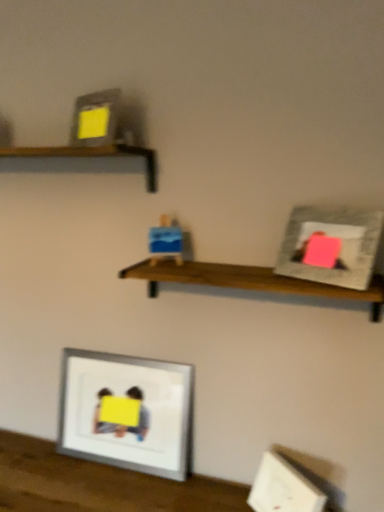
Question: Can you confirm if matte gray picture frame at upper right, the first picture frame from the front, is taller than wooden shelf at center, which is counted as the first shelf, starting from the right?

Choices:
 (A) no
 (B) yes

Answer: (B)

Question: Is matte gray picture frame at upper right, the 2th picture frame when ordered from back to front, touching wooden shelf at center, which is the 2th shelf in left-to-right order?

Choices:
 (A) no
 (B) yes

Answer: (A)

Question: Is matte gray picture frame at upper right, the first picture frame from the front, closer to camera compared to wooden shelf at center, which is the 2th shelf in top-to-bottom order?

Choices:
 (A) no
 (B) yes

Answer: (B)

Question: From a real-world perspective, is matte gray picture frame at upper right, placed as the 2th picture frame when sorted from left to right, positioned under wooden shelf at center, which is the 2th shelf in top-to-bottom order, based on gravity?

Choices:
 (A) yes
 (B) no

Answer: (B)

Question: Can we say matte gray picture frame at upper right, arranged as the first picture frame when viewed from the top, lies outside wooden shelf at center, the first shelf positioned from the bottom?

Choices:
 (A) no
 (B) yes

Answer: (B)

Question: In the image, is wooden shelf at upper left, which appears as the 1th shelf when viewed from the left, on the left side or the right side of wooden shelf at center, which is the 2th shelf in top-to-bottom order?

Choices:
 (A) right
 (B) left

Answer: (B)

Question: Which is correct: wooden shelf at upper left, positioned as the second shelf in right-to-left order, is inside wooden shelf at center, the first shelf positioned from the bottom, or outside of it?

Choices:
 (A) inside
 (B) outside

Answer: (B)

Question: Looking at the image, does wooden shelf at upper left, the first shelf viewed from the top, seem bigger or smaller compared to wooden shelf at center, which is the 2th shelf in top-to-bottom order?

Choices:
 (A) small
 (B) big

Answer: (A)

Question: Is wooden shelf at upper left, which appears as the 1th shelf when viewed from the left, wider or thinner than wooden shelf at center, which is the 2th shelf in top-to-bottom order?

Choices:
 (A) wide
 (B) thin

Answer: (B)

Question: From the image's perspective, is matte gray picture frame at upper right, the 2th picture frame in the bottom-to-top sequence, above or below wooden shelf at upper left, arranged as the second shelf when ordered from the bottom?

Choices:
 (A) above
 (B) below

Answer: (B)

Question: Is matte gray picture frame at upper right, arranged as the first picture frame when viewed from the top, to the left or to the right of wooden shelf at upper left, which appears as the 1th shelf when viewed from the left, in the image?

Choices:
 (A) left
 (B) right

Answer: (B)

Question: Does point [299, 266] appear closer or farther from the camera than point [120, 148]?

Choices:
 (A) closer
 (B) farther

Answer: (A)

Question: Is matte gray picture frame at upper right, arranged as the first picture frame when viewed from the top, inside the boundaries of wooden shelf at upper left, the first shelf viewed from the top, or outside?

Choices:
 (A) inside
 (B) outside

Answer: (B)

Question: In terms of width, does blue cardboard box at center look wider or thinner when compared to silver metallic picture frame at lower center, which ranks as the second picture frame in right-to-left order?

Choices:
 (A) wide
 (B) thin

Answer: (A)

Question: In the image, is blue cardboard box at center on the left side or the right side of silver metallic picture frame at lower center, acting as the 2th picture frame starting from the top?

Choices:
 (A) left
 (B) right

Answer: (B)